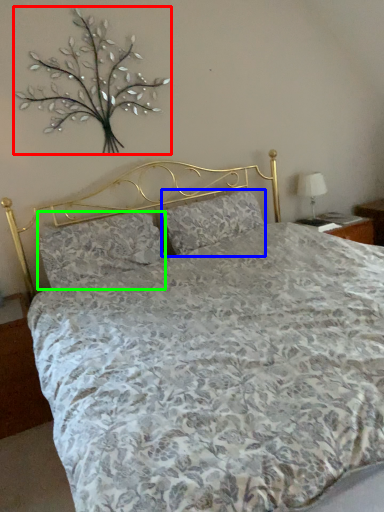
Question: Considering the real-world distances, which object is farthest from floral arrangement (highlighted by a red box)? pillow (highlighted by a blue box) or pillow (highlighted by a green box)?

Choices:
 (A) pillow
 (B) pillow

Answer: (A)